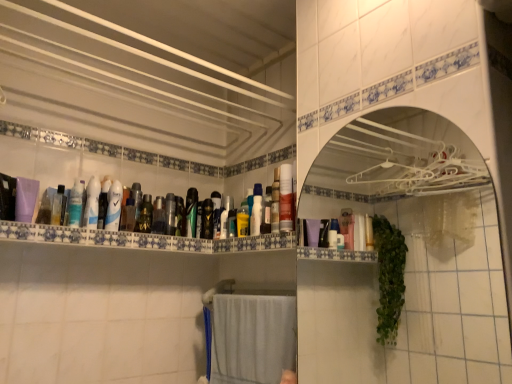
Question: From a real-world perspective, is blue glossy mouthwash at upper left, which is the thirteenth mouthwash in right-to-left order, positioned over translucent plastic mouthwash at center, arranged as the tenth mouthwash when viewed from the right, based on gravity?

Choices:
 (A) yes
 (B) no

Answer: (A)

Question: Is blue glossy mouthwash at upper left, which is the thirteenth mouthwash in right-to-left order, aimed at translucent plastic mouthwash at center, arranged as the tenth mouthwash when viewed from the right?

Choices:
 (A) no
 (B) yes

Answer: (A)

Question: Is blue glossy mouthwash at upper left, which is the thirteenth mouthwash in right-to-left order, positioned far away from translucent plastic mouthwash at center, which is the fifth mouthwash in left-to-right order?

Choices:
 (A) yes
 (B) no

Answer: (B)

Question: Is blue glossy mouthwash at upper left, placed as the second mouthwash when sorted from left to right, behind translucent plastic mouthwash at center, arranged as the tenth mouthwash when viewed from the right?

Choices:
 (A) no
 (B) yes

Answer: (A)

Question: Is blue glossy mouthwash at upper left, which is the thirteenth mouthwash in right-to-left order, oriented away from translucent plastic mouthwash at center, arranged as the tenth mouthwash when viewed from the right?

Choices:
 (A) yes
 (B) no

Answer: (B)

Question: From the image's perspective, is blue glossy mouthwash at upper left, placed as the second mouthwash when sorted from left to right, located above translucent plastic mouthwash at center, arranged as the tenth mouthwash when viewed from the right?

Choices:
 (A) no
 (B) yes

Answer: (B)

Question: From the image's perspective, is green matte bottle at center, which appears as the 6th mouthwash when viewed from the left, above yellow matte bottle at center, placed as the thirteenth mouthwash when sorted from left to right?

Choices:
 (A) yes
 (B) no

Answer: (A)

Question: From a real-world perspective, is green matte bottle at center, the ninth mouthwash in the right-to-left sequence, on yellow matte bottle at center, placed as the thirteenth mouthwash when sorted from left to right?

Choices:
 (A) yes
 (B) no

Answer: (A)

Question: Are green matte bottle at center, which appears as the 6th mouthwash when viewed from the left, and yellow matte bottle at center, placed as the thirteenth mouthwash when sorted from left to right, beside each other?

Choices:
 (A) no
 (B) yes

Answer: (A)

Question: From a real-world perspective, is green matte bottle at center, the ninth mouthwash in the right-to-left sequence, positioned under yellow matte bottle at center, which is the second mouthwash in right-to-left order, based on gravity?

Choices:
 (A) no
 (B) yes

Answer: (A)

Question: Considering the relative positions of green matte bottle at center, the ninth mouthwash in the right-to-left sequence, and yellow matte bottle at center, placed as the thirteenth mouthwash when sorted from left to right, in the image provided, is green matte bottle at center, the ninth mouthwash in the right-to-left sequence, behind yellow matte bottle at center, placed as the thirteenth mouthwash when sorted from left to right,?

Choices:
 (A) no
 (B) yes

Answer: (B)

Question: Is green matte bottle at center, which appears as the 6th mouthwash when viewed from the left, thinner than yellow matte bottle at center, placed as the thirteenth mouthwash when sorted from left to right?

Choices:
 (A) yes
 (B) no

Answer: (A)

Question: Is green glossy mouthwash at center, which is the sixth mouthwash in right-to-left order, not inside metallic silver mouthwash at center, acting as the 8th mouthwash starting from the left?

Choices:
 (A) yes
 (B) no

Answer: (A)